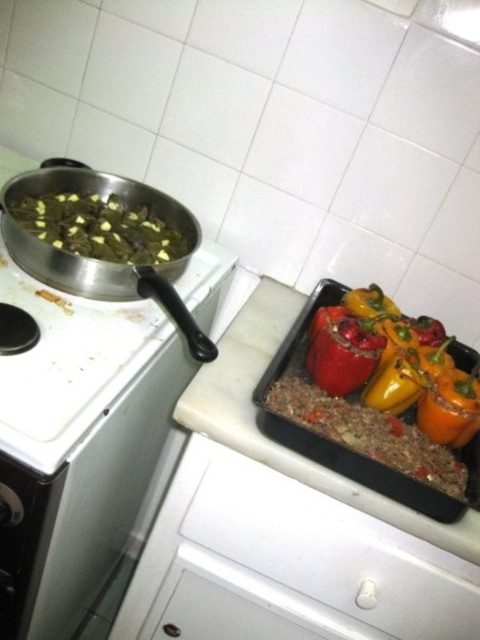
This screenshot has width=480, height=640. What do you see at coordinates (331, 550) in the screenshot? I see `white plastic drawer at lower center` at bounding box center [331, 550].

Which is more to the right, white plastic drawer at lower center or green matte vegetables at left?

From the viewer's perspective, white plastic drawer at lower center appears more on the right side.

What are the coordinates of `white plastic drawer at lower center` in the screenshot? It's located at (331, 550).

Who is positioned more to the right, smooth orange bell pepper at right or green matte vegetables at left?

From the viewer's perspective, smooth orange bell pepper at right appears more on the right side.

In the scene shown: Is smooth orange bell pepper at right further to the viewer compared to green matte vegetables at left?

No, smooth orange bell pepper at right is in front of green matte vegetables at left.

Describe the element at coordinates (419, 376) in the screenshot. Image resolution: width=480 pixels, height=640 pixels. I see `smooth orange bell pepper at right` at that location.

Locate an element on the screen. smooth orange bell pepper at right is located at coordinates (419, 376).

Can you confirm if white plastic drawer at lower center is bigger than smooth orange bell pepper at right?

No.

Who is more forward, (227, 477) or (364, 394)?

Point (227, 477) is more forward.

You are a GUI agent. You are given a task and a screenshot of the screen. Output one action in this format:
    pyautogui.click(x=<x>, y=<y>)
    Task: Click on the white plastic drawer at lower center
    Image resolution: width=480 pixels, height=640 pixels.
    Given the screenshot: What is the action you would take?
    pyautogui.click(x=331, y=550)